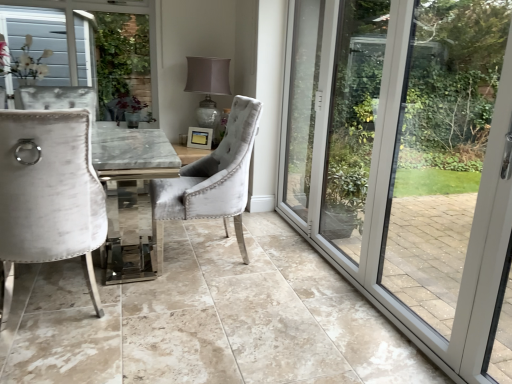
Identify the location of free space in front of velvet grey chair at center, acting as the second chair starting from the left. (217, 296).